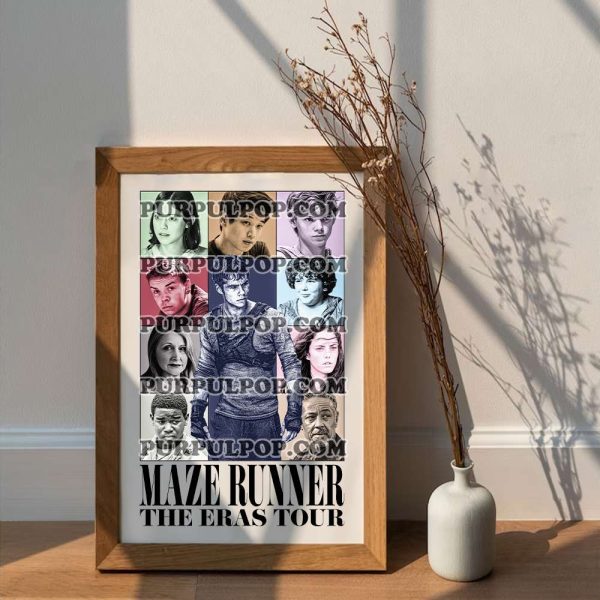
I want to click on canvas, so click(x=377, y=471).